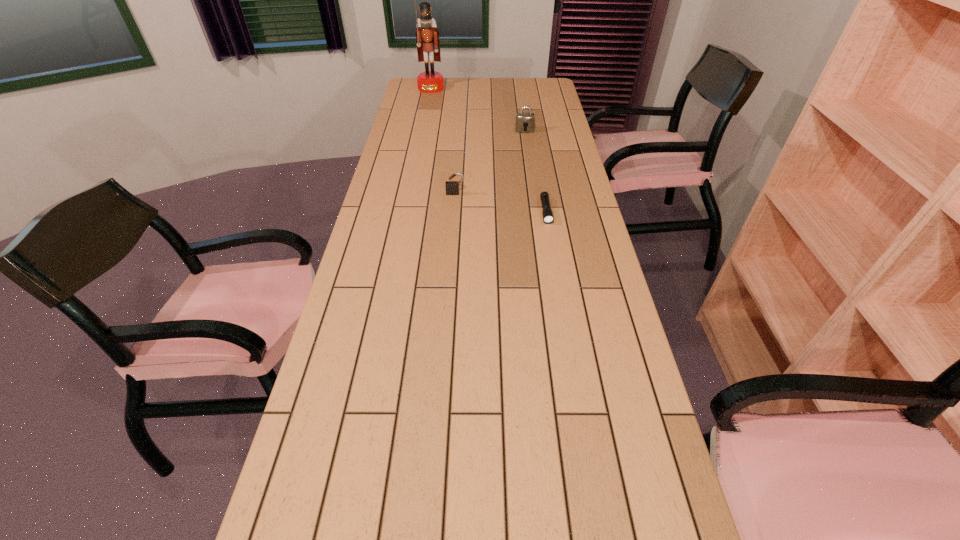
The width and height of the screenshot is (960, 540). Identify the location of unoccupied position between the taller padlock and the nearest object. (536, 171).

You are a GUI agent. You are given a task and a screenshot of the screen. Output one action in this format:
    pyautogui.click(x=<x>, y=<y>)
    Task: Click on the free spot between the flashlight and the third farthest object
    This screenshot has width=960, height=540.
    Given the screenshot: What is the action you would take?
    501,202

Point out which object is positioned as the second nearest to the farthest object. Please provide its 2D coordinates. Your answer should be formatted as a tuple, i.e. [(x, y)], where the tuple contains the x and y coordinates of a point satisfying the conditions above.

[(452, 187)]

Identify the location of the second closest object to the nearer padlock. The image size is (960, 540). (525, 121).